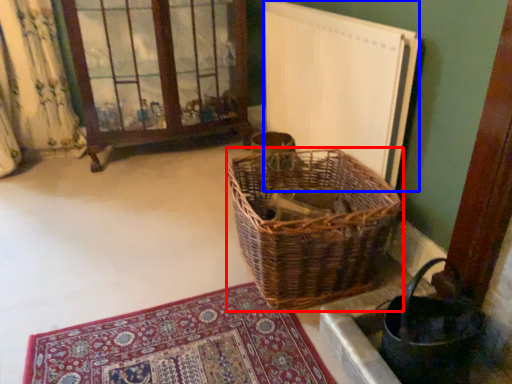
Question: Among these objects, which one is nearest to the camera, picnic basket (highlighted by a red box) or radiator (highlighted by a blue box)?

Choices:
 (A) picnic basket
 (B) radiator

Answer: (A)